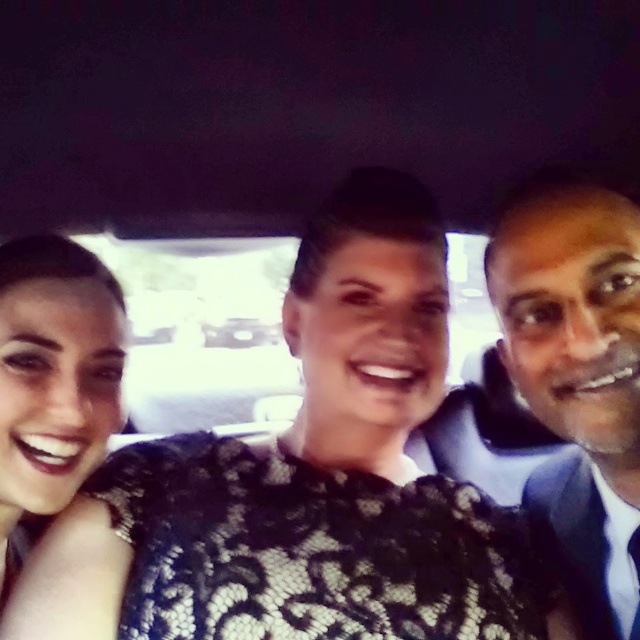
Question: Among these points, which one is nearest to the camera?

Choices:
 (A) (378, 348)
 (B) (76, 301)
 (C) (596, 548)

Answer: (A)

Question: Is black lace dress at center below matte black dress at left?

Choices:
 (A) no
 (B) yes

Answer: (B)

Question: Is black lace dress at center in front of blue suit at right?

Choices:
 (A) yes
 (B) no

Answer: (A)

Question: Is black lace dress at center smaller than matte black dress at left?

Choices:
 (A) no
 (B) yes

Answer: (A)

Question: Which of these objects is positioned closest to the black lace dress at center?

Choices:
 (A) matte black dress at left
 (B) blue suit at right

Answer: (B)

Question: Which point is farther from the camera taking this photo?

Choices:
 (A) (4, 392)
 (B) (154, 449)

Answer: (B)